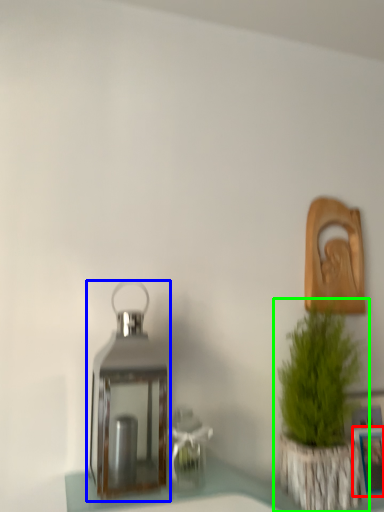
Question: Which is nearer to the picture frame (highlighted by a red box)? lantern (highlighted by a blue box) or houseplant (highlighted by a green box).

Choices:
 (A) lantern
 (B) houseplant

Answer: (B)